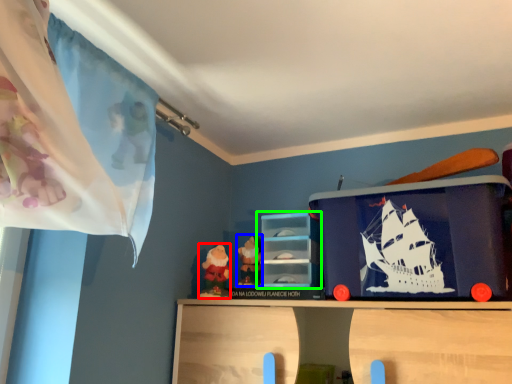
Question: Based on their relative distances, which object is nearer to toy (highlighted by a red box)? Choose from toy (highlighted by a blue box) and shelf (highlighted by a green box).

Choices:
 (A) toy
 (B) shelf

Answer: (A)